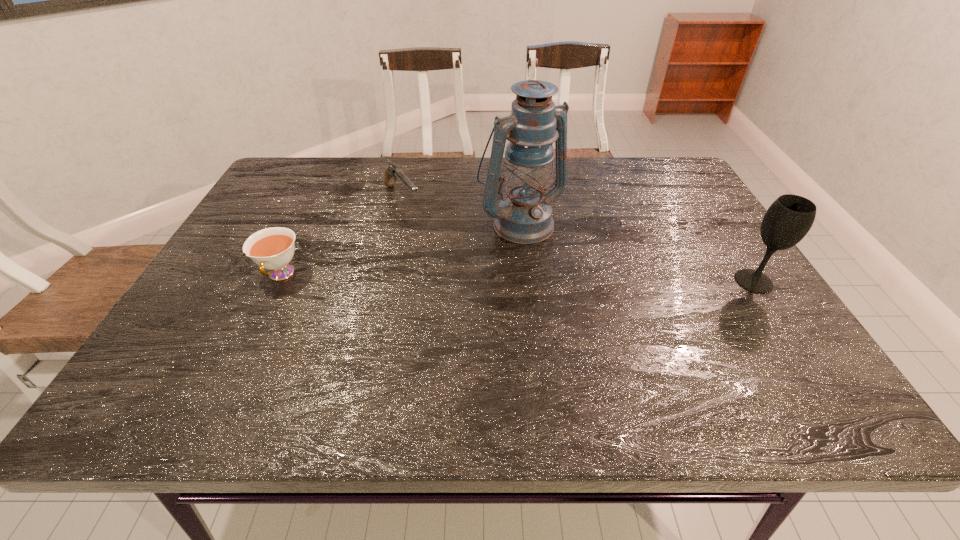
What are the coordinates of `free location located on the front-facing side of the lantern` in the screenshot? It's located at (643, 343).

This screenshot has width=960, height=540. In order to click on vacant space situated aiming along the barrel of the second object from left to right in this screenshot , I will do `click(438, 249)`.

Where is `vacant space situated aiming along the barrel of the second object from left to right`? vacant space situated aiming along the barrel of the second object from left to right is located at coordinates (444, 255).

At what (x,y) coordinates should I click in order to perform the action: click on vacant area situated aiming along the barrel of the second object from left to right. Please return your answer as a coordinate pair (x, y). Looking at the image, I should click on (455, 269).

What are the coordinates of `object located at the far edge` in the screenshot? It's located at (392, 172).

Find the location of `object that is at the left edge`. object that is at the left edge is located at coordinates (273, 248).

This screenshot has height=540, width=960. Find the location of `object that is at the right edge`. object that is at the right edge is located at coordinates (790, 217).

In the image, there is a desktop. Identify the location of vacant space at the far edge. This screenshot has height=540, width=960. (400, 158).

This screenshot has height=540, width=960. Find the location of `vacant area at the near edge of the desktop`. vacant area at the near edge of the desktop is located at coordinates (267, 355).

Where is `vacant space at the right edge of the desktop`? The image size is (960, 540). vacant space at the right edge of the desktop is located at coordinates (669, 213).